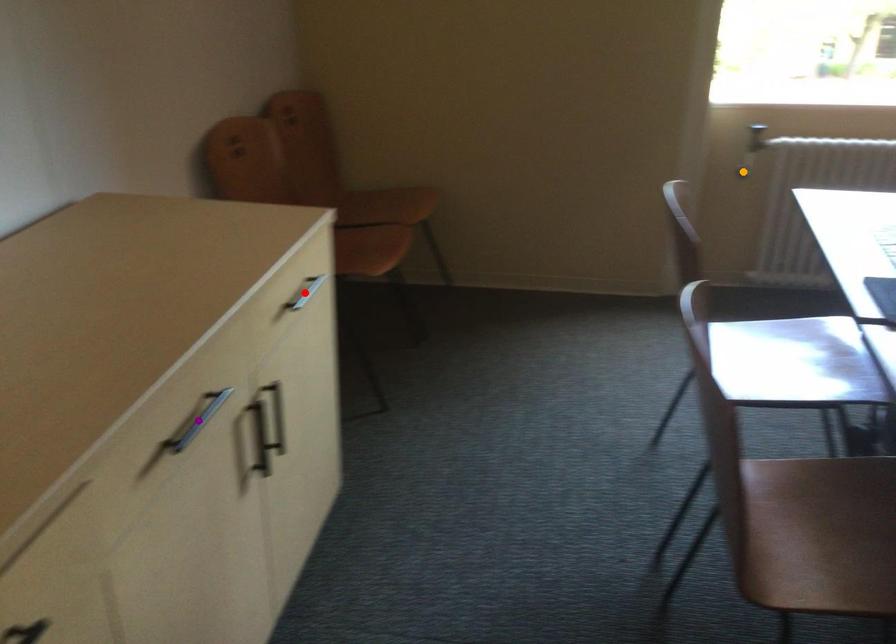
Order these from nearest to farthest:
1. red point
2. orange point
3. purple point

purple point
red point
orange point